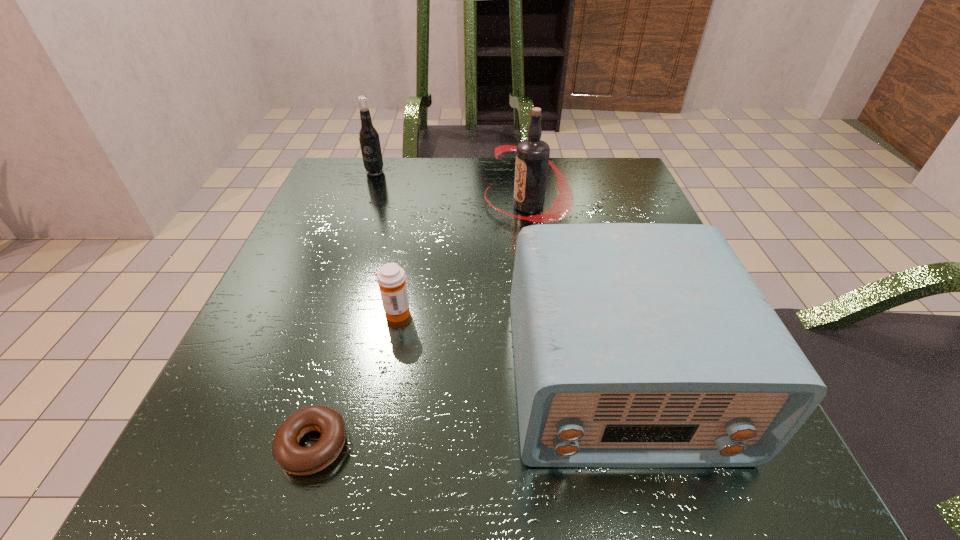
What are the coordinates of `free space between the fourth tallest object and the nearer root beer` in the screenshot? It's located at (462, 259).

This screenshot has width=960, height=540. Find the location of `vacant area that lies between the doughnut and the fourth tallest object`. vacant area that lies between the doughnut and the fourth tallest object is located at coordinates (355, 379).

I want to click on free point between the medicine and the tallest object, so click(462, 259).

Identify the location of vacant point located between the medicine and the nearer root beer. (462, 259).

Identify the location of vacant area between the shorter root beer and the medicine. (386, 242).

What are the coordinates of `free spot between the nearer root beer and the left root beer` in the screenshot? It's located at (451, 188).

Select which object appears as the closest to the medicine. Please provide its 2D coordinates. Your answer should be formatted as a tuple, i.e. [(x, y)], where the tuple contains the x and y coordinates of a point satisfying the conditions above.

[(636, 345)]

Locate an element on the screen. The width and height of the screenshot is (960, 540). object that is the fourth nearest to the doughnut is located at coordinates (369, 140).

What are the coordinates of `vacant area that satisfies the following two spatial constraints: 1. on the label of the second farthest object; 2. on the front side of the third object from left to right` in the screenshot? It's located at (543, 313).

Identify the location of free space that satisfies the following two spatial constraints: 1. on the label of the farthest object; 2. on the left side of the medicine. (324, 313).